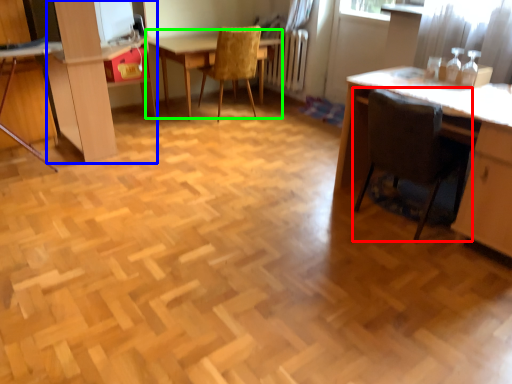
Question: Which is farther away from chair (highlighted by a red box)? dresser (highlighted by a blue box) or table (highlighted by a green box)?

Choices:
 (A) dresser
 (B) table

Answer: (B)